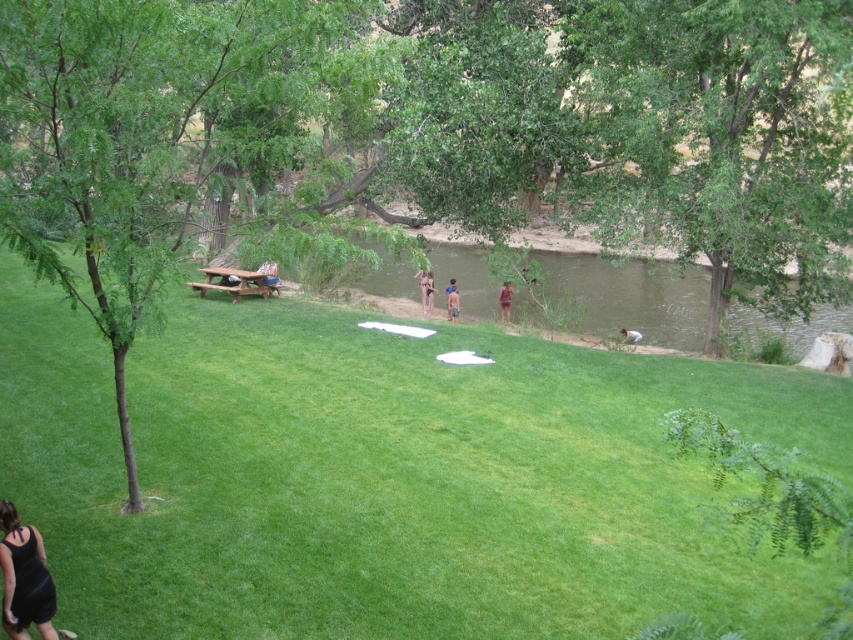
You are planning to take a photo of the black matte dress at lower left and the light brown wooden stick at lower center. Which object should you focus on first to ensure both are in the frame?

The black matte dress at lower left is in front of the light brown wooden stick at lower center, so you should focus on the black matte dress at lower left first to ensure both are in the frame.

You are planning to set up a tent in the area shown in the image. You have a tent that requires a space wider than the black matte dress at lower left. Can the green leafy tree at center provide enough space for your tent?

The green leafy tree at center might be wider than the black matte dress at lower left, so it could potentially provide sufficient space for your tent if the required width is met.

You are planning to set up a small tent between the green leafy tree at center and the brown textured swimsuit at center. Which object should you place the tent closer to if you want it to be near the wider object?

You should place the tent closer to the green leafy tree at center because its width surpasses that of the brown textured swimsuit at center.